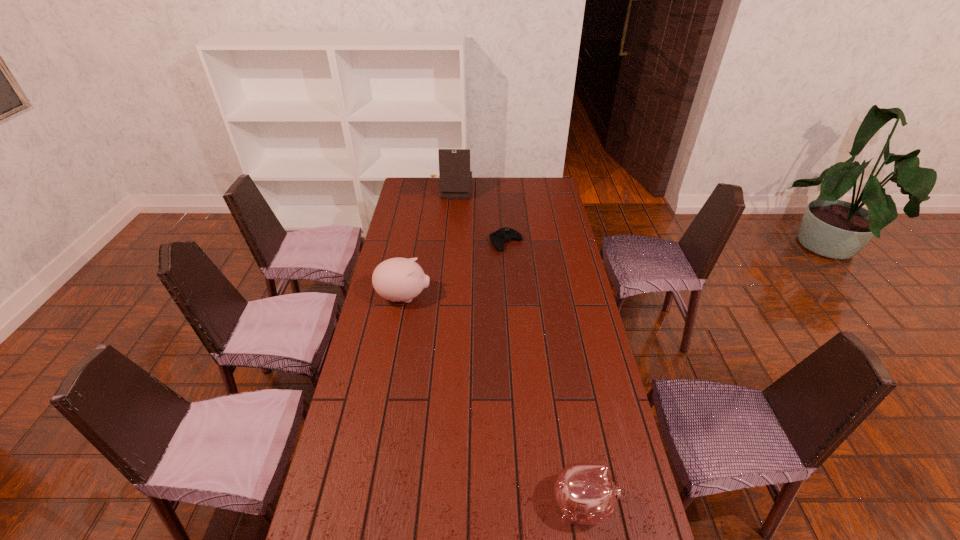
Where is `free spot located 0.090m on the right of the second farthest object`? free spot located 0.090m on the right of the second farthest object is located at coordinates (542, 242).

Locate an element on the screen. This screenshot has width=960, height=540. object located in the far edge section of the desktop is located at coordinates click(x=455, y=176).

I want to click on phonograph record that is at the left edge, so click(455, 176).

Where is `piggy bank present at the left edge`? piggy bank present at the left edge is located at coordinates (398, 279).

Locate an element on the screen. This screenshot has height=540, width=960. object that is at the right edge is located at coordinates (585, 493).

You are a GUI agent. You are given a task and a screenshot of the screen. Output one action in this format:
    pyautogui.click(x=<x>, y=<y>)
    Task: Click on the object positioned at the far left corner
    
    Given the screenshot: What is the action you would take?
    pyautogui.click(x=455, y=176)

Where is `vacant area at the left edge`? vacant area at the left edge is located at coordinates (383, 373).

Where is `blank area at the right edge`? The image size is (960, 540). blank area at the right edge is located at coordinates (545, 222).

Image resolution: width=960 pixels, height=540 pixels. Identify the location of free space between the third nearest object and the shorter piggy bank. (544, 374).

You are a GUI agent. You are given a task and a screenshot of the screen. Output one action in this format:
    pyautogui.click(x=<x>, y=<y>)
    Task: Click on the unoccupied area between the nearer piggy bank and the third nearest object
    The height and width of the screenshot is (540, 960).
    Given the screenshot: What is the action you would take?
    pyautogui.click(x=544, y=374)